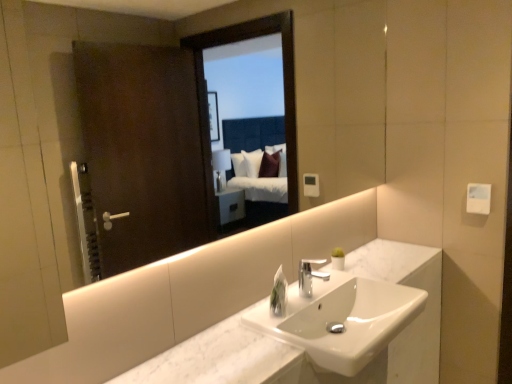
Find the location of `white marble sink at center`. white marble sink at center is located at coordinates (350, 328).

The height and width of the screenshot is (384, 512). Identify the location of white marble counter at center. (302, 348).

I want to click on clear plastic soap dispenser at center, so click(279, 294).

Based on their sizes in the image, would you say white marble sink at center is bigger or smaller than clear plastic soap dispenser at center?

white marble sink at center is bigger than clear plastic soap dispenser at center.

Can you confirm if white marble sink at center is positioned to the left of clear plastic soap dispenser at center?

Incorrect, white marble sink at center is not on the left side of clear plastic soap dispenser at center.

Is white marble sink at center inside or outside of clear plastic soap dispenser at center?

white marble sink at center is not enclosed by clear plastic soap dispenser at center.

Between white marble sink at center and clear plastic soap dispenser at center, which one has more height?

With more height is white marble sink at center.

Looking at this image, can you confirm if white marble counter at center is smaller than clear plastic soap dispenser at center?

No, white marble counter at center is not smaller than clear plastic soap dispenser at center.

From a real-world perspective, is white marble counter at center physically located above or below clear plastic soap dispenser at center?

white marble counter at center is situated lower than clear plastic soap dispenser at center in the real world.

Is white marble counter at center facing towards clear plastic soap dispenser at center?

No, white marble counter at center is not facing towards clear plastic soap dispenser at center.

Visually, is white marble counter at center positioned to the left or to the right of clear plastic soap dispenser at center?

From the image, it's evident that white marble counter at center is to the right of clear plastic soap dispenser at center.

Is clear plastic soap dispenser at center aimed at white marble counter at center?

No, clear plastic soap dispenser at center is not turned towards white marble counter at center.

Based on the photo, measure the distance between clear plastic soap dispenser at center and white marble counter at center.

clear plastic soap dispenser at center is 19.26 inches away from white marble counter at center.

Considering the sizes of clear plastic soap dispenser at center and white marble counter at center in the image, is clear plastic soap dispenser at center wider or thinner than white marble counter at center?

Considering their sizes, clear plastic soap dispenser at center looks slimmer than white marble counter at center.

Can you tell me how much clear plastic soap dispenser at center and white marble counter at center differ in facing direction?

The angular difference between clear plastic soap dispenser at center and white marble counter at center is 25.1 degrees.

Is clear plastic soap dispenser at center taller or shorter than white marble sink at center?

Clearly, clear plastic soap dispenser at center is shorter compared to white marble sink at center.

Which is behind, clear plastic soap dispenser at center or white marble sink at center?

Positioned behind is clear plastic soap dispenser at center.

Consider the image. Considering the relative sizes of clear plastic soap dispenser at center and white marble sink at center in the image provided, is clear plastic soap dispenser at center wider than white marble sink at center?

No.

Is white marble sink at center located within clear plastic soap dispenser at center?

No, clear plastic soap dispenser at center does not contain white marble sink at center.

Would you consider silver metallic faucet at center to be distant from white marble counter at center?

silver metallic faucet at center is near white marble counter at center, not far away.

In the image, is silver metallic faucet at center positioned in front of or behind white marble counter at center?

Clearly, silver metallic faucet at center is behind white marble counter at center.

From a real-world perspective, does silver metallic faucet at center stand above white marble counter at center?

Correct, in the physical world, silver metallic faucet at center is higher than white marble counter at center.

At what (x,y) coordinates should I click in order to perform the action: click on tap that is above the white marble counter at center (from a real-world perspective). Please return your answer as a coordinate pair (x, y). Image resolution: width=512 pixels, height=384 pixels. Looking at the image, I should click on (310, 276).

Which is in front, white marble sink at center or silver metallic faucet at center?

white marble sink at center is in front.

Would you say white marble sink at center is inside or outside silver metallic faucet at center?

white marble sink at center is outside silver metallic faucet at center.

Is white marble sink at center bigger or smaller than silver metallic faucet at center?

In the image, white marble sink at center appears to be larger than silver metallic faucet at center.

Would you consider white marble sink at center to be distant from silver metallic faucet at center?

white marble sink at center is near silver metallic faucet at center, not far away.

Could white marble sink at center be considered to be inside silver metallic faucet at center?

No.

Can you confirm if silver metallic faucet at center is smaller than white marble sink at center?

Indeed, silver metallic faucet at center has a smaller size compared to white marble sink at center.

From the image's perspective, would you say silver metallic faucet at center is positioned over white marble sink at center?

Yes.

Is point (304, 285) closer or farther from the camera than point (403, 328)?

Point (304, 285) is positioned closer to the camera compared to point (403, 328).

Where is `soap dispenser above the white marble sink at center (from the image's perspective)`? soap dispenser above the white marble sink at center (from the image's perspective) is located at coordinates (279, 294).

Locate an element on the screen. The height and width of the screenshot is (384, 512). counter in front of the clear plastic soap dispenser at center is located at coordinates (302, 348).

When comparing their distances from silver metallic faucet at center, does white marble counter at center or clear plastic soap dispenser at center seem closer?

Answer: The object closer to silver metallic faucet at center is clear plastic soap dispenser at center.

From the image, which object appears to be farther from silver metallic faucet at center, white marble counter at center or white marble sink at center?

The object further to silver metallic faucet at center is white marble counter at center.

Which object lies nearer to the anchor point clear plastic soap dispenser at center, white marble counter at center or silver metallic faucet at center?

Based on the image, silver metallic faucet at center appears to be nearer to clear plastic soap dispenser at center.

From the image, which object appears to be nearer to white marble counter at center, white marble sink at center or silver metallic faucet at center?

white marble sink at center is positioned closer to the anchor white marble counter at center.

Which object lies further to the anchor point white marble counter at center, clear plastic soap dispenser at center or silver metallic faucet at center?

Among the two, clear plastic soap dispenser at center is located further to white marble counter at center.

Based on the photo, from the image, which object appears to be farther from white marble sink at center, silver metallic faucet at center or clear plastic soap dispenser at center?

clear plastic soap dispenser at center lies further to white marble sink at center than the other object.

Based on their spatial positions, is silver metallic faucet at center or white marble counter at center closer to clear plastic soap dispenser at center?

Based on the image, silver metallic faucet at center appears to be nearer to clear plastic soap dispenser at center.

Looking at the image, which one is located closer to clear plastic soap dispenser at center, white marble sink at center or white marble counter at center?

Among the two, white marble sink at center is located nearer to clear plastic soap dispenser at center.

Locate an element on the screen. This screenshot has height=384, width=512. soap dispenser between white marble sink at center and silver metallic faucet at center in the front-back direction is located at coordinates (279, 294).

I want to click on sink between white marble counter at center and silver metallic faucet at center from front to back, so click(350, 328).

The image size is (512, 384). In order to click on soap dispenser between white marble counter at center and silver metallic faucet at center in the front-back direction in this screenshot , I will do `click(279, 294)`.

This screenshot has width=512, height=384. What are the coordinates of `sink positioned between white marble counter at center and clear plastic soap dispenser at center from near to far` in the screenshot? It's located at (350, 328).